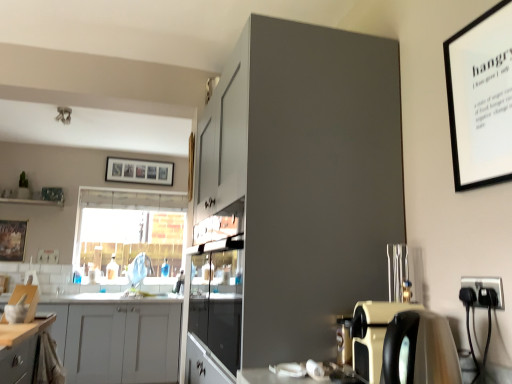
Question: From the image's perspective, is matte gray cabinet at upper center, the second cabinetry positioned from the bottom, located beneath wooden framed artwork at left, the 2th picture frame in the top-to-bottom sequence?

Choices:
 (A) yes
 (B) no

Answer: (B)

Question: Is matte gray cabinet at upper center, the second cabinetry positioned from the bottom, to the left of wooden framed artwork at left, the 1th picture frame from the front, from the viewer's perspective?

Choices:
 (A) yes
 (B) no

Answer: (B)

Question: Considering the relative sizes of matte gray cabinet at upper center, positioned as the second cabinetry in back-to-front order, and wooden framed artwork at left, arranged as the first picture frame when viewed from the left, in the image provided, is matte gray cabinet at upper center, positioned as the second cabinetry in back-to-front order, thinner than wooden framed artwork at left, arranged as the first picture frame when viewed from the left,?

Choices:
 (A) no
 (B) yes

Answer: (A)

Question: Considering the relative positions of matte gray cabinet at upper center, acting as the second cabinetry starting from the left, and wooden framed artwork at left, which appears as the 2th picture frame when viewed from the right, in the image provided, is matte gray cabinet at upper center, acting as the second cabinetry starting from the left, to the right of wooden framed artwork at left, which appears as the 2th picture frame when viewed from the right, from the viewer's perspective?

Choices:
 (A) yes
 (B) no

Answer: (A)

Question: Is matte gray cabinet at upper center, the 1th cabinetry viewed from the right, bigger than wooden framed artwork at left, which is counted as the 2th picture frame, starting from the back?

Choices:
 (A) yes
 (B) no

Answer: (A)

Question: Visually, is matte black coffee machine at lower right positioned to the left or to the right of clear glass window at center?

Choices:
 (A) left
 (B) right

Answer: (B)

Question: Is point (432, 324) positioned closer to the camera than point (145, 226)?

Choices:
 (A) closer
 (B) farther

Answer: (A)

Question: Is matte black coffee machine at lower right wider or thinner than clear glass window at center?

Choices:
 (A) wide
 (B) thin

Answer: (A)

Question: Choose the correct answer: Is matte black coffee machine at lower right inside clear glass window at center or outside it?

Choices:
 (A) outside
 (B) inside

Answer: (A)

Question: Considering the positions of black plastic electrical outlet at lower right and white matte cabinet at lower left, the 1th cabinetry when ordered from back to front, in the image, is black plastic electrical outlet at lower right bigger or smaller than white matte cabinet at lower left, the 1th cabinetry when ordered from back to front,?

Choices:
 (A) small
 (B) big

Answer: (A)

Question: Is black plastic electrical outlet at lower right taller or shorter than white matte cabinet at lower left, the 1th cabinetry when ordered from back to front?

Choices:
 (A) short
 (B) tall

Answer: (A)

Question: In terms of width, does black plastic electrical outlet at lower right look wider or thinner when compared to white matte cabinet at lower left, acting as the 1th cabinetry starting from the left?

Choices:
 (A) wide
 (B) thin

Answer: (B)

Question: From the image's perspective, is black plastic electrical outlet at lower right located above or below white matte cabinet at lower left, acting as the 1th cabinetry starting from the left?

Choices:
 (A) below
 (B) above

Answer: (B)

Question: From the image's perspective, is white matte cabinet at lower left, which appears as the 2th cabinetry when viewed from the right, positioned above or below matte gray cabinet at upper center, which ranks as the 1th cabinetry in top-to-bottom order?

Choices:
 (A) below
 (B) above

Answer: (A)

Question: From a real-world perspective, is white matte cabinet at lower left, marked as the first cabinetry in a bottom-to-top arrangement, above or below matte gray cabinet at upper center, positioned as the second cabinetry in back-to-front order?

Choices:
 (A) below
 (B) above

Answer: (A)